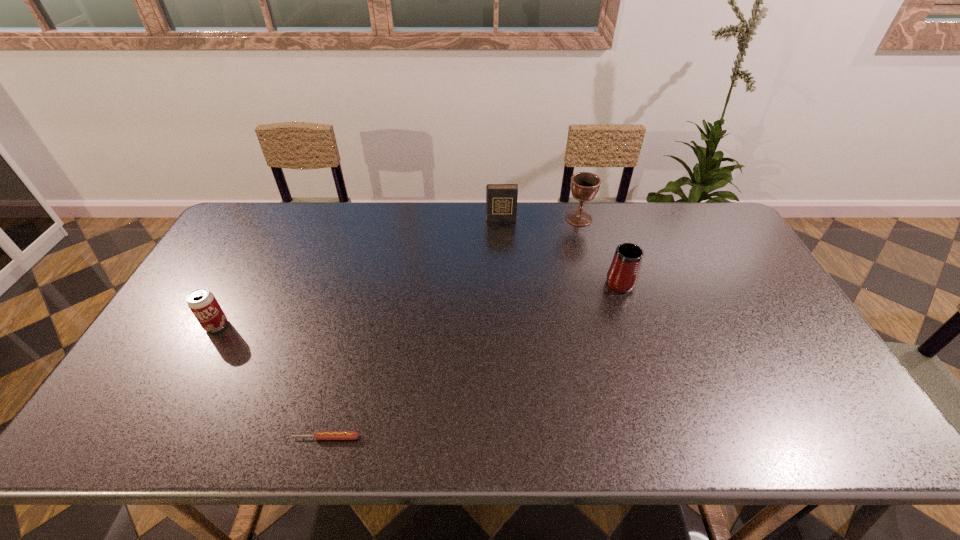
The height and width of the screenshot is (540, 960). Find the location of `chalice`. chalice is located at coordinates click(584, 185).

Find the location of a particular element. Image resolution: width=960 pixels, height=540 pixels. diary is located at coordinates (501, 199).

This screenshot has height=540, width=960. In order to click on mug in this screenshot , I will do pyautogui.click(x=622, y=276).

In order to click on beer can in this screenshot , I will do `click(203, 304)`.

Find the location of a particular element. the second nearest object is located at coordinates (203, 304).

You are a GUI agent. You are given a task and a screenshot of the screen. Output one action in this format:
    pyautogui.click(x=<x>, y=<y>)
    Task: Click on the shortest object
    Image resolution: width=960 pixels, height=540 pixels.
    Given the screenshot: What is the action you would take?
    pyautogui.click(x=319, y=435)

You are a GUI agent. You are given a task and a screenshot of the screen. Output one action in this format:
    pyautogui.click(x=<x>, y=<y>)
    Task: Click on the second object from left to right
    
    Given the screenshot: What is the action you would take?
    pyautogui.click(x=319, y=435)

Identify the location of free point located on the right of the chalice. (652, 219).

The image size is (960, 540). In order to click on free space located on the front cover of the third object from right to left in this screenshot , I will do `click(504, 282)`.

Find the location of a particular element. vacant point located 0.120m on the side of the third farthest object with the handle is located at coordinates (607, 242).